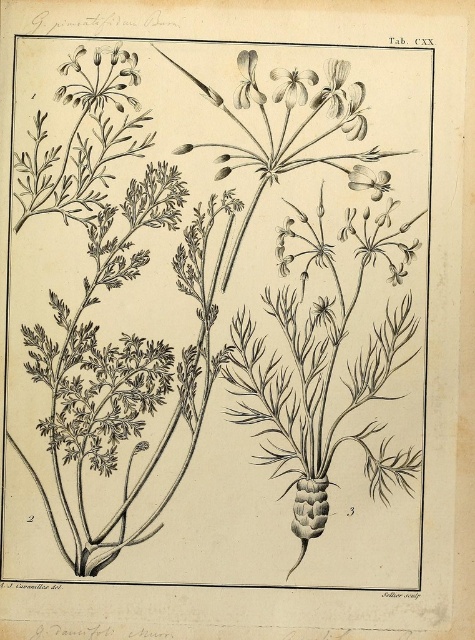
You are an entomologist examining the botanical illustration. You notice two sets of white delicate petals at upper center and white delicate petals at upper left. Which set is closer to your viewpoint?

The white delicate petals at upper center are closer to the viewer than the white delicate petals at upper left.

You are an botanist examining this botanical illustration. You notice two floral features in the upper part of the image. One is the smooth white flower at upper right and the other is the white delicate petals at upper left. Which of these two features is located more to the right side of the illustration?

The smooth white flower at upper right is positioned on the right side of the white delicate petals at upper left, so the smooth white flower at upper right is more to the right in the illustration.